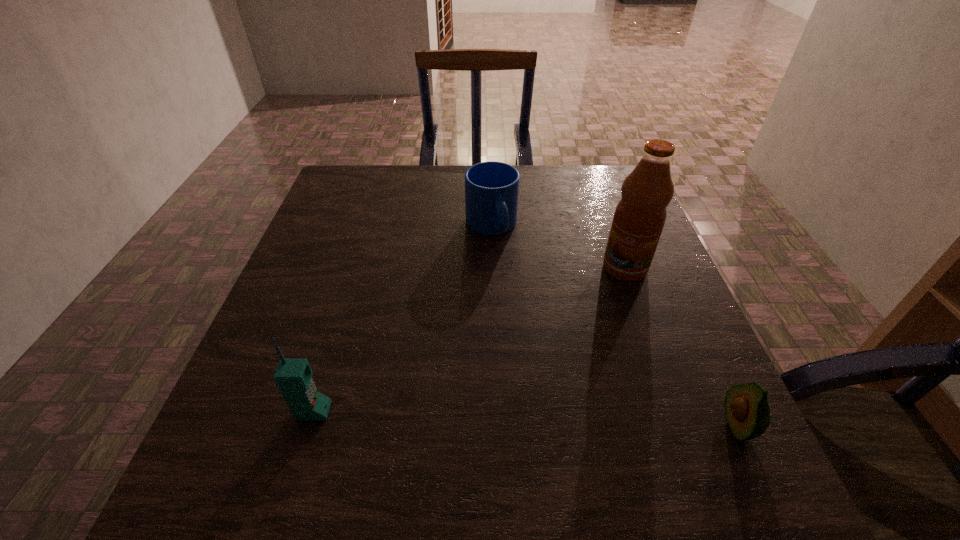
Locate an element on the screen. The image size is (960, 540). the third shortest object is located at coordinates 293,376.

Identify the location of cellular telephone. (293, 376).

Find the location of a particular element. avocado is located at coordinates (747, 411).

Where is `the second farthest object`? This screenshot has height=540, width=960. the second farthest object is located at coordinates (639, 218).

The height and width of the screenshot is (540, 960). What are the coordinates of `the second object from right to left` in the screenshot? It's located at (639, 218).

At what (x,y) coordinates should I click in order to perform the action: click on the farthest object. Please return your answer as a coordinate pair (x, y). Image resolution: width=960 pixels, height=540 pixels. Looking at the image, I should click on (491, 188).

I want to click on mug, so click(491, 188).

You are a GUI agent. You are given a task and a screenshot of the screen. Output one action in this format:
    pyautogui.click(x=<x>, y=<y>)
    Task: Click on the vacant region located on the keypad of the cellular telephone
    This screenshot has width=960, height=540.
    Given the screenshot: What is the action you would take?
    pyautogui.click(x=410, y=411)

Find the location of a particular element. The height and width of the screenshot is (540, 960). vacant region located on the cut side of the rightmost object is located at coordinates (574, 426).

The image size is (960, 540). I want to click on vacant space located on the cut side of the rightmost object, so click(633, 426).